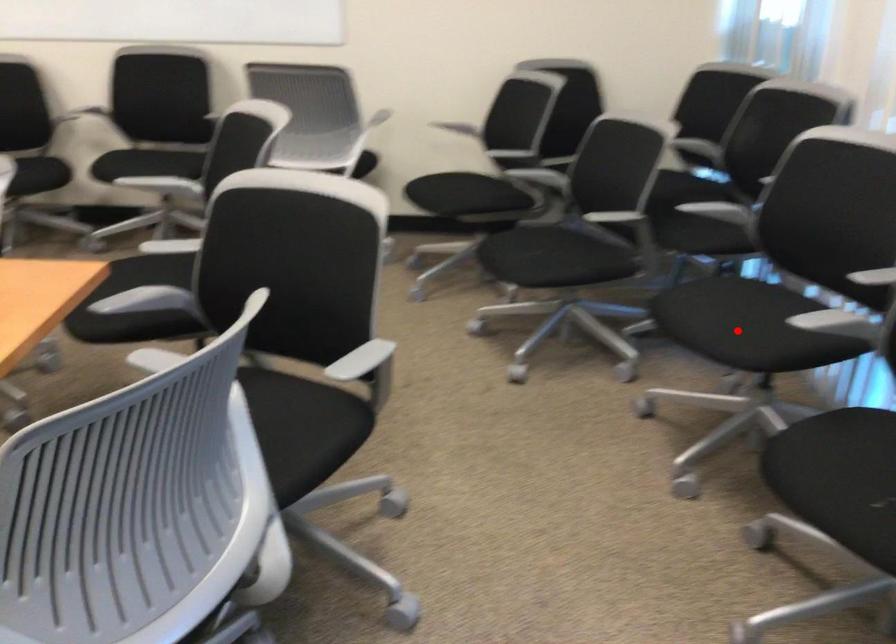
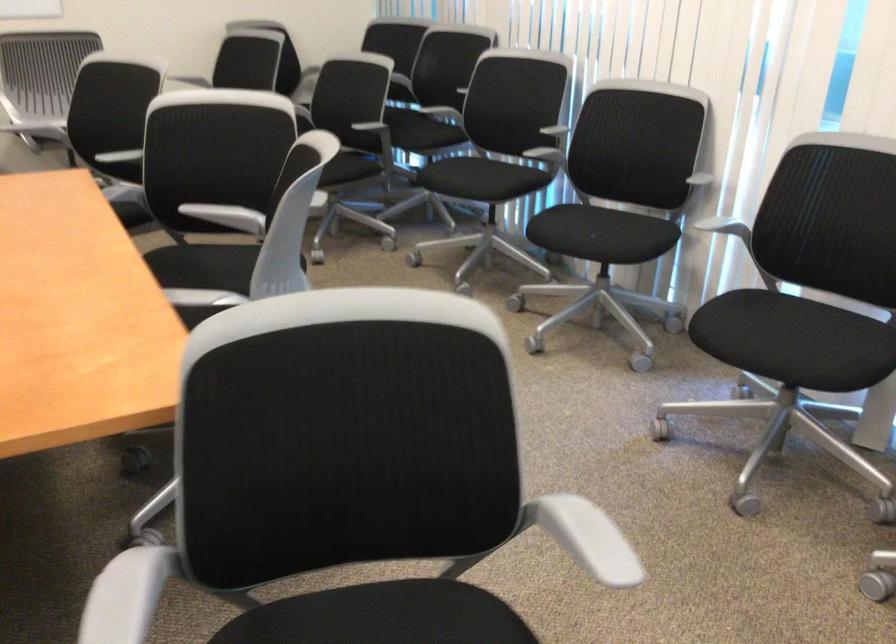
Where in the second image is the point corresponding to the highlighted location from the first image?

(480, 178)